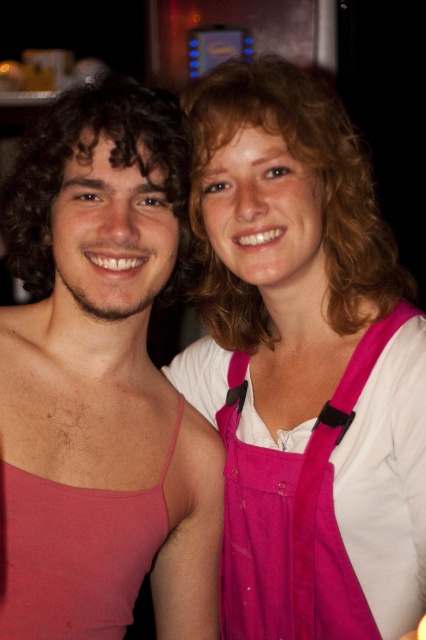
You are a photographer preparing to take a portrait of two people wearing the pink matte tank top at center and the pink fabric apron at center. Which clothing item will be more noticeable in the photo due to its size?

The pink matte tank top at center is bigger than the pink fabric apron at center, so it will be more noticeable in the photo due to its larger size.

You are a photographer trying to capture the pink matte tank top at center and the pink fabric apron at center in a clear shot. Since both are at the center, which one is closer to the camera?

The pink matte tank top at center is located above the pink fabric apron at center, so it is closer to the camera.

You are a photographer adjusting your camera settings to capture the two people in the scene. You notice both the pink fabric dress at center and the pink fabric apron at center. Which of these items is closer to the camera?

The pink fabric dress at center is closer to the camera because it is in front of the pink fabric apron at center.